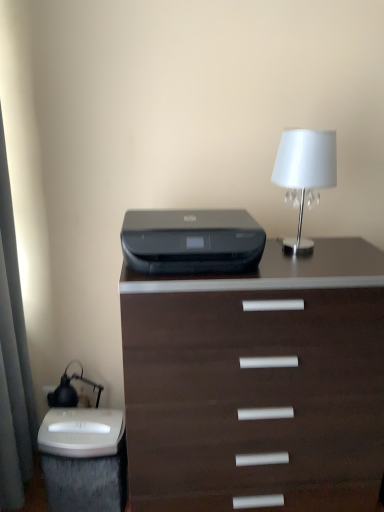
I want to click on empty space that is ontop of black plastic printer at center (from a real-world perspective), so click(x=194, y=221).